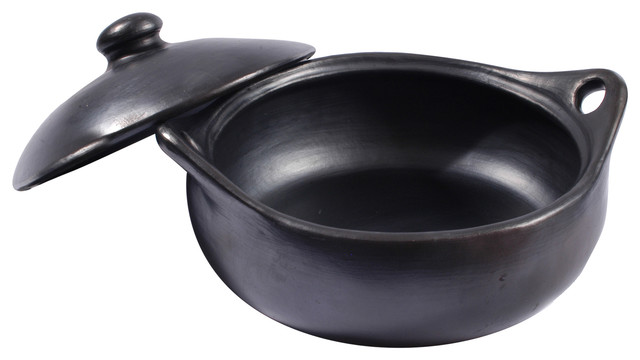
Where is `light reflections in pot`? This screenshot has height=360, width=640. light reflections in pot is located at coordinates (498, 173), (285, 160).